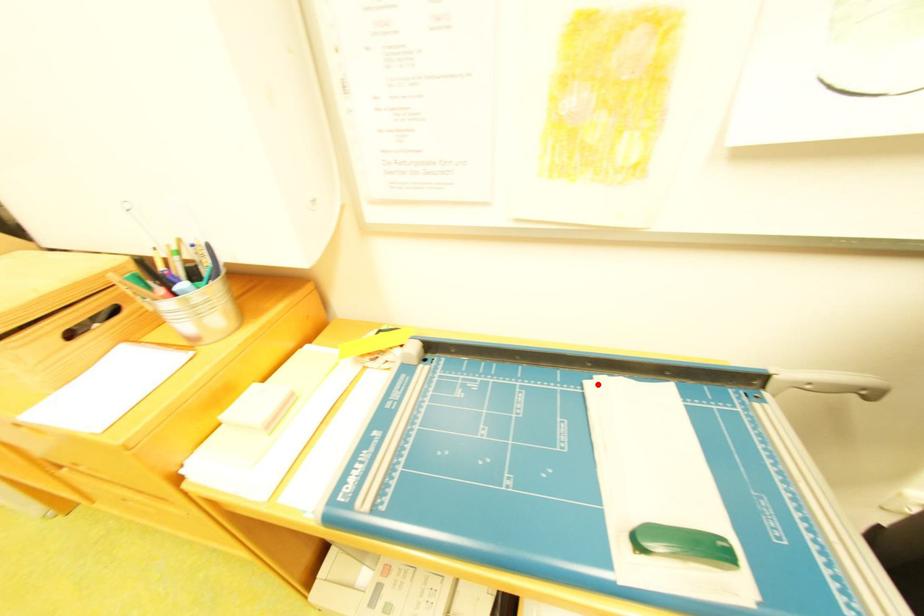
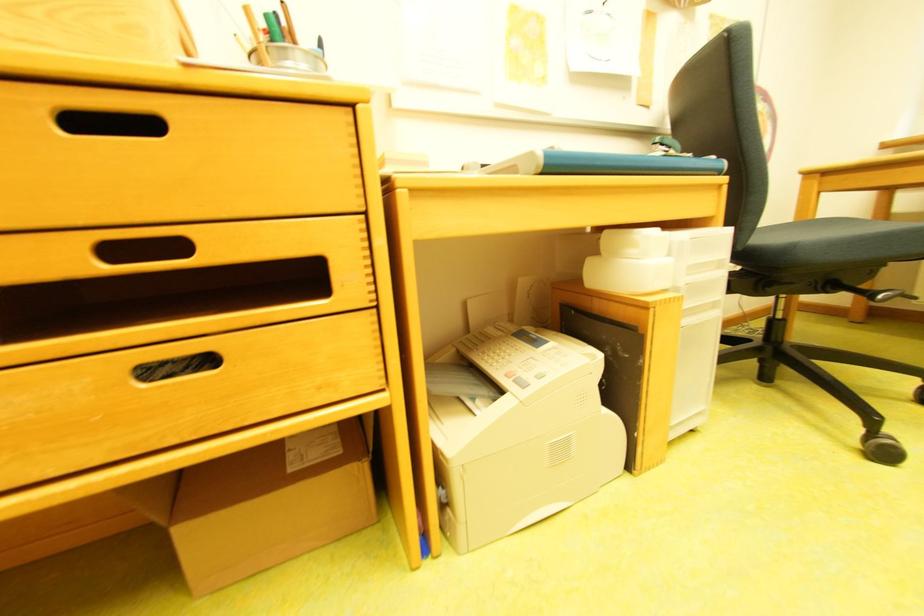
Question: I am providing you with two images of the same scene from different viewpoints. A red point is marked on the first image. Is the red point's position out of view in image 2?

Choices:
 (A) Yes
 (B) No

Answer: (A)